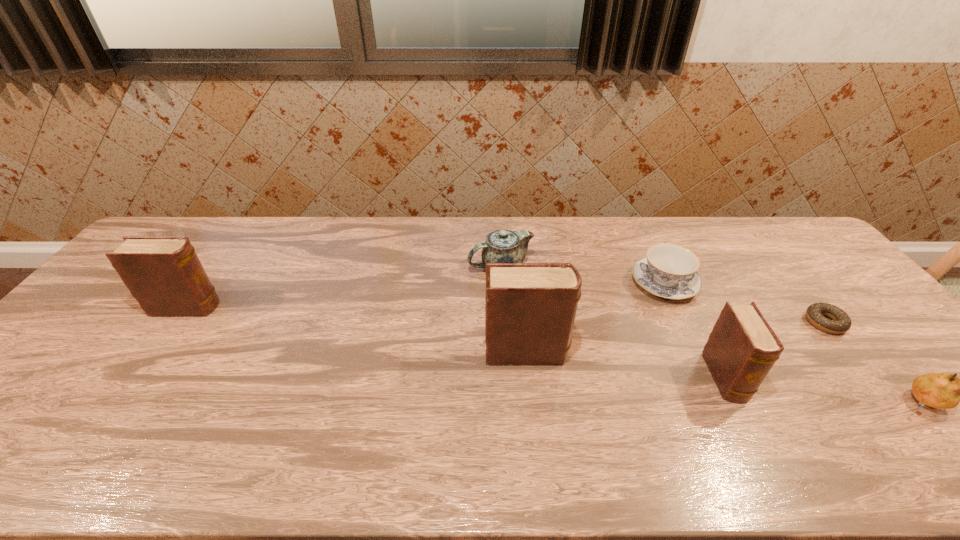
At what (x,y) coordinates should I click in order to perform the action: click on free space that satisfies the following two spatial constraints: 1. on the spine side of the pear; 2. on the right side of the second diary from right to left. Please return your answer as a coordinate pair (x, y). The image size is (960, 540). Looking at the image, I should click on (532, 401).

Identify the location of vacant area in the image that satisfies the following two spatial constraints: 1. from the spout of the pear; 2. on the left side of the taller chinaware. This screenshot has height=540, width=960. (508, 401).

This screenshot has width=960, height=540. Identify the location of vacant position in the image that satisfies the following two spatial constraints: 1. on the spine side of the shortest diary; 2. on the right side of the pear. pos(737,401).

Locate an element on the screen. vacant space that satisfies the following two spatial constraints: 1. from the spout of the fourth shortest object; 2. on the left side of the pear is located at coordinates click(508, 401).

At what (x,y) coordinates should I click in order to perform the action: click on vacant space that satisfies the following two spatial constraints: 1. from the spout of the pear; 2. on the left side of the left chinaware. Please return your answer as a coordinate pair (x, y). This screenshot has width=960, height=540. Looking at the image, I should click on (508, 401).

This screenshot has height=540, width=960. I want to click on vacant space that satisfies the following two spatial constraints: 1. on the spine side of the second diary from right to left; 2. on the left side of the pear, so coord(532,401).